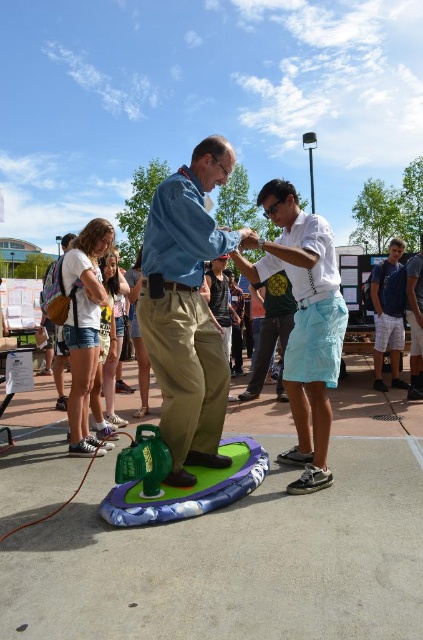
Does white cotton shirt at center appear on the left side of blue denim shorts at lower right?

Yes, white cotton shirt at center is to the left of blue denim shorts at lower right.

Can you confirm if white cotton shirt at center is shorter than blue denim shorts at lower right?

Incorrect, white cotton shirt at center's height does not fall short of blue denim shorts at lower right's.

Measure the distance between point (313,458) and camera.

Point (313,458) and camera are 3.25 meters apart from each other.

I want to click on white cotton shirt at center, so click(x=304, y=323).

Measure the distance between blue denim shirt at center and blue denim shorts at lower right.

A distance of 3.84 meters exists between blue denim shirt at center and blue denim shorts at lower right.

Is blue denim shirt at center taller than blue denim shorts at lower right?

Correct, blue denim shirt at center is much taller as blue denim shorts at lower right.

Between point (216, 232) and point (376, 308), which one is positioned behind?

The point (376, 308) is more distant.

I want to click on blue denim shirt at center, so click(x=186, y=308).

Can you confirm if white cotton shirt at center is shorter than green rubber mat at center?

No.

Between white cotton shirt at center and green rubber mat at center, which one appears on the left side from the viewer's perspective?

green rubber mat at center is more to the left.

Identify the location of white cotton shirt at center. Image resolution: width=423 pixels, height=640 pixels. (304, 323).